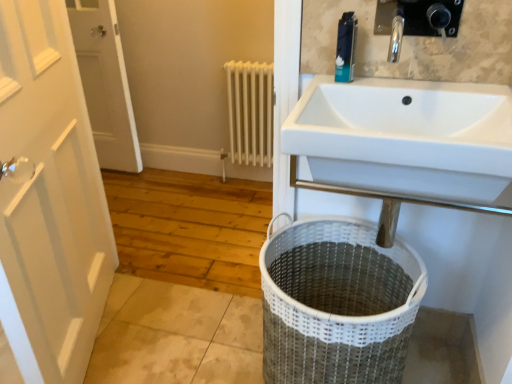
Locate an element on the screen. The image size is (512, 384). vacant area that is situated to the right of blue plastic toothpaste tube at upper center is located at coordinates (403, 91).